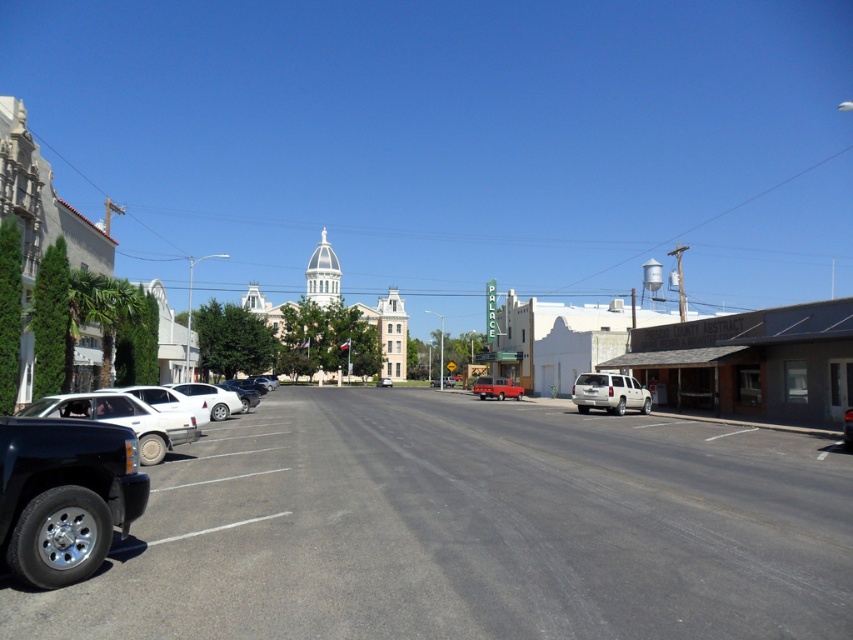
Does matte white truck at center have a greater width compared to metallic silver sedan at center?

Correct, the width of matte white truck at center exceeds that of metallic silver sedan at center.

Is matte white truck at center to the right of metallic silver sedan at center from the viewer's perspective?

Indeed, matte white truck at center is positioned on the right side of metallic silver sedan at center.

The width and height of the screenshot is (853, 640). What are the coordinates of `matte white truck at center` in the screenshot? It's located at (447, 381).

In the scene shown: Is matte black truck at left closer to camera compared to white matte suv at center-right?

Yes, matte black truck at left is closer to the viewer.

Does point (184, 420) come behind point (598, 403)?

No.

Does point (146, 448) lie behind point (607, 385)?

No.

The height and width of the screenshot is (640, 853). Find the location of `matte black truck at left`. matte black truck at left is located at coordinates (122, 419).

Is metallic silver van at center below metallic silver sedan at center?

No, metallic silver van at center is not below metallic silver sedan at center.

Between metallic silver van at center and metallic silver sedan at center, which one appears on the right side from the viewer's perspective?

From the viewer's perspective, metallic silver van at center appears more on the right side.

The width and height of the screenshot is (853, 640). What do you see at coordinates (496, 387) in the screenshot?
I see `metallic silver van at center` at bounding box center [496, 387].

Image resolution: width=853 pixels, height=640 pixels. What are the coordinates of `metallic silver van at center` in the screenshot? It's located at (496, 387).